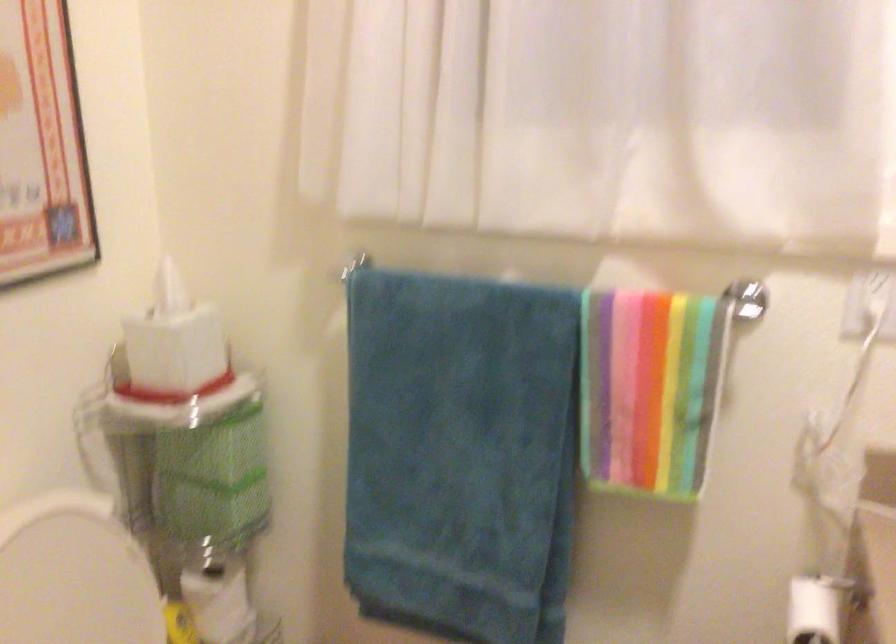
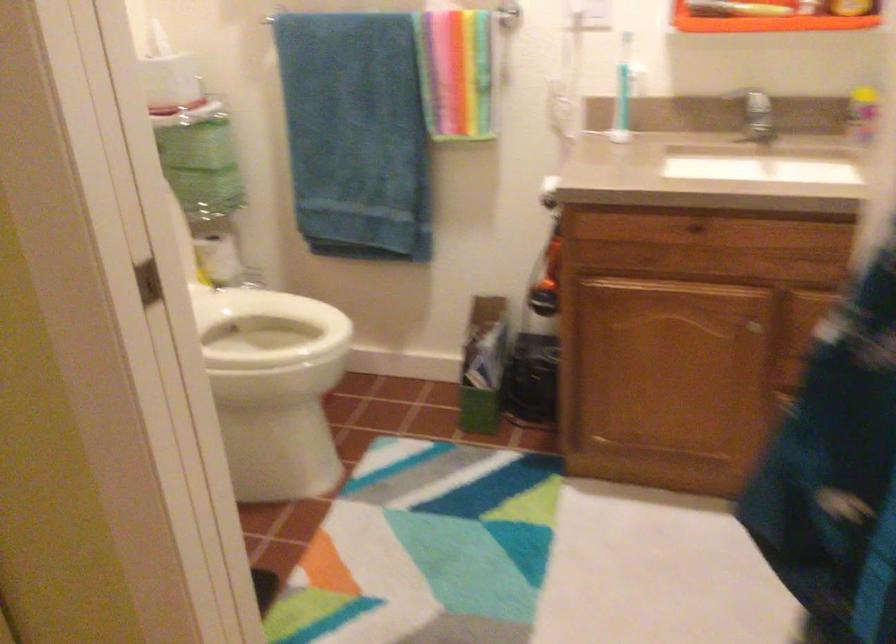
Question: What movement of the cameraman would produce the second image?

Choices:
 (A) Left
 (B) Right
 (C) Forward
 (D) Backward

Answer: (D)